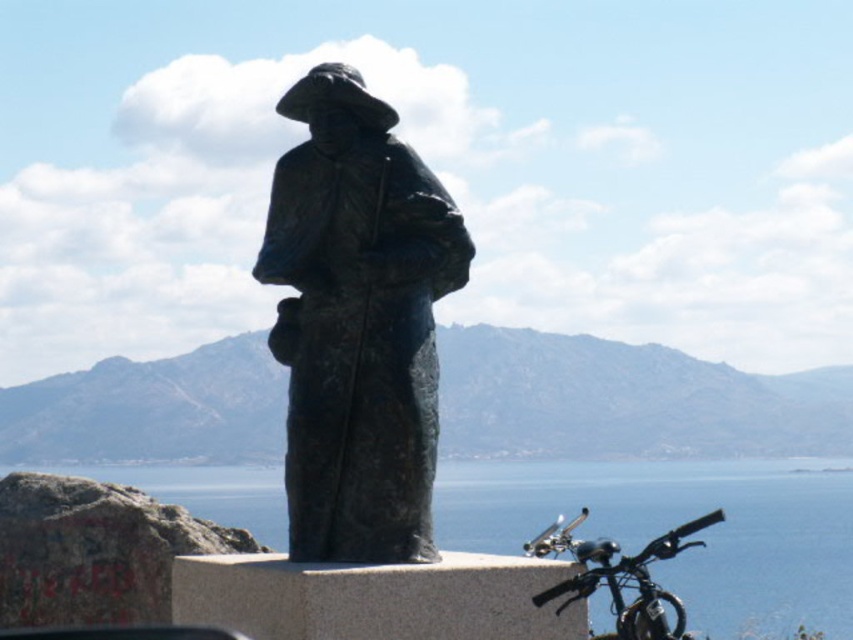
Question: Based on their relative distances, which object is farther from the blue water at lower right?

Choices:
 (A) bronze statue at center
 (B) shiny black bicycle at lower right

Answer: (A)

Question: Observing the image, what is the correct spatial positioning of bronze statue at center in reference to blue water at lower right?

Choices:
 (A) left
 (B) right

Answer: (A)

Question: Is bronze statue at center below shiny black bicycle at lower right?

Choices:
 (A) no
 (B) yes

Answer: (A)

Question: Is bronze statue at center thinner than blue water at lower right?

Choices:
 (A) no
 (B) yes

Answer: (B)

Question: Which point appears farthest from the camera in this image?

Choices:
 (A) (643, 611)
 (B) (747, 580)
 (C) (287, 512)

Answer: (B)

Question: Which point is closer to the camera?

Choices:
 (A) [612, 588]
 (B) [735, 550]
 (C) [434, 394]

Answer: (C)